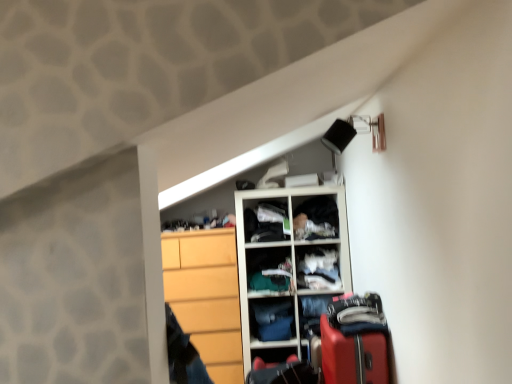
Question: Can you confirm if white plastic cabinet at upper center, arranged as the first cabinet when viewed from the top, is thinner than matte black suitcase at lower right, which is the 2th luggage in top-to-bottom order?

Choices:
 (A) no
 (B) yes

Answer: (B)

Question: From the image's perspective, is white plastic cabinet at upper center, the second cabinet viewed from the right, below matte black suitcase at lower right, the 1th luggage positioned from the bottom?

Choices:
 (A) no
 (B) yes

Answer: (A)

Question: Does white plastic cabinet at upper center, the 2th cabinet from the bottom, have a larger size compared to matte black suitcase at lower right, which is the 1th luggage from back to front?

Choices:
 (A) no
 (B) yes

Answer: (A)

Question: Is white plastic cabinet at upper center, the 2th cabinet from the bottom, outside matte black suitcase at lower right, which is the 1th luggage from back to front?

Choices:
 (A) yes
 (B) no

Answer: (A)

Question: From the image's perspective, is white plastic cabinet at upper center, the second cabinet viewed from the right, above matte black suitcase at lower right, the second luggage from the right?

Choices:
 (A) no
 (B) yes

Answer: (B)

Question: From a real-world perspective, relative to white fabric at center, arranged as the 1th cabinet when ordered from the bottom, is dark blue fabric at center vertically above or below?

Choices:
 (A) above
 (B) below

Answer: (B)

Question: Is dark blue fabric at center in front of or behind white fabric at center, arranged as the 1th cabinet when ordered from the bottom, in the image?

Choices:
 (A) behind
 (B) front

Answer: (A)

Question: Would you say dark blue fabric at center is to the left or to the right of white fabric at center, the 1th cabinet when ordered from right to left, in the picture?

Choices:
 (A) right
 (B) left

Answer: (B)

Question: Is point (246, 253) closer or farther from the camera than point (305, 286)?

Choices:
 (A) closer
 (B) farther

Answer: (B)

Question: Is white fabric at center, arranged as the 1th cabinet when ordered from the bottom, bigger or smaller than rubberized red suitcase at lower right, which ranks as the second luggage in bottom-to-top order?

Choices:
 (A) big
 (B) small

Answer: (B)

Question: From a real-world perspective, is white fabric at center, the 1th cabinet when ordered from right to left, above or below rubberized red suitcase at lower right, positioned as the first luggage in right-to-left order?

Choices:
 (A) above
 (B) below

Answer: (A)

Question: From the image's perspective, is white fabric at center, arranged as the 1th cabinet when ordered from the bottom, located above or below rubberized red suitcase at lower right, arranged as the second luggage when viewed from the left?

Choices:
 (A) above
 (B) below

Answer: (A)

Question: Do you think white fabric at center, arranged as the 1th cabinet when ordered from the bottom, is within rubberized red suitcase at lower right, the second luggage in the back-to-front sequence, or outside of it?

Choices:
 (A) inside
 (B) outside

Answer: (B)

Question: From the image's perspective, is white plastic cabinet at upper center, the 2th cabinet from the bottom, above or below white fabric at center, the 1th cabinet when ordered from right to left?

Choices:
 (A) below
 (B) above

Answer: (B)

Question: Does point [253, 228] appear closer or farther from the camera than point [317, 266]?

Choices:
 (A) closer
 (B) farther

Answer: (B)